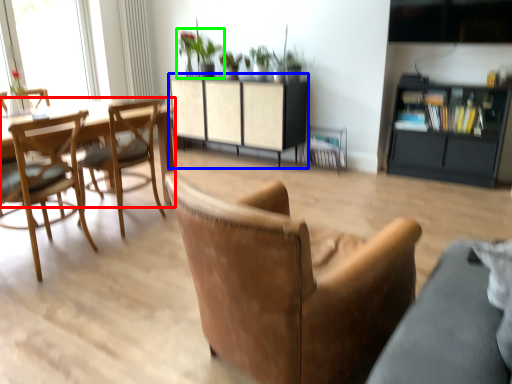
Question: Which object is positioned closest to round table (highlighted by a red box)? Select from cabinetry (highlighted by a blue box) and houseplant (highlighted by a green box).

Choices:
 (A) cabinetry
 (B) houseplant

Answer: (A)